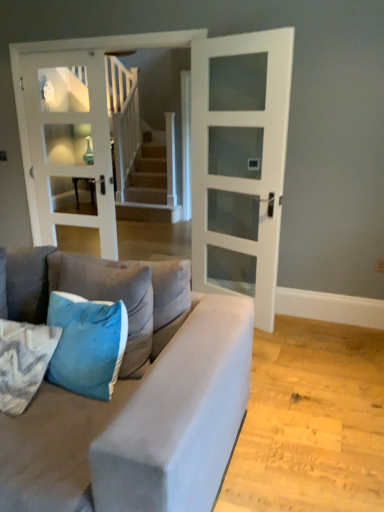
The height and width of the screenshot is (512, 384). What do you see at coordinates (111, 296) in the screenshot?
I see `velvet blue pillow at lower left, the third pillow in the left-to-right sequence` at bounding box center [111, 296].

What do you see at coordinates (70, 141) in the screenshot? I see `white glass door at center, the 2th door in the right-to-left sequence` at bounding box center [70, 141].

Locate an element on the screen. The width and height of the screenshot is (384, 512). suede gray couch at lower left is located at coordinates (129, 400).

The width and height of the screenshot is (384, 512). I want to click on velvet blue pillow at lower left, the first pillow when ordered from right to left, so click(111, 296).

From their relative heights in the image, would you say teal velvet pillow at lower left, marked as the 2th pillow in a right-to-left arrangement, is taller or shorter than white glass door at center, the 2th door when ordered from left to right?

Clearly, teal velvet pillow at lower left, marked as the 2th pillow in a right-to-left arrangement, is shorter compared to white glass door at center, the 2th door when ordered from left to right.

Are teal velvet pillow at lower left, marked as the 2th pillow in a right-to-left arrangement, and white glass door at center, the 2th door when ordered from left to right, located far from each other?

Yes, teal velvet pillow at lower left, marked as the 2th pillow in a right-to-left arrangement, and white glass door at center, the 2th door when ordered from left to right, are located far from each other.

Is white glass door at center, the 2th door when ordered from left to right, surrounded by teal velvet pillow at lower left, marked as the 2th pillow in a right-to-left arrangement?

No, white glass door at center, the 2th door when ordered from left to right, is not inside teal velvet pillow at lower left, marked as the 2th pillow in a right-to-left arrangement.

Based on their sizes in the image, would you say teal velvet pillow at lower left, marked as the 2th pillow in a right-to-left arrangement, is bigger or smaller than white glass door at center, which is counted as the 1th door, starting from the right?

Clearly, teal velvet pillow at lower left, marked as the 2th pillow in a right-to-left arrangement, is smaller in size than white glass door at center, which is counted as the 1th door, starting from the right.

Is white glass door at center, the 2th door when ordered from left to right, closer to the viewer compared to blue fabric pillow at lower left, which is the 1th pillow in left-to-right order?

No.

Looking at this image, is blue fabric pillow at lower left, which is the 3th pillow from right to left, surrounded by white glass door at center, which is counted as the 1th door, starting from the right?

No, blue fabric pillow at lower left, which is the 3th pillow from right to left, is not inside white glass door at center, which is counted as the 1th door, starting from the right.

Is white glass door at center, which is counted as the 1th door, starting from the right, turned away from blue fabric pillow at lower left, which is the 1th pillow in left-to-right order?

No, white glass door at center, which is counted as the 1th door, starting from the right,'s orientation is not away from blue fabric pillow at lower left, which is the 1th pillow in left-to-right order.

From the image's perspective, is white glass door at center, which is counted as the 1th door, starting from the right, positioned above or below blue fabric pillow at lower left, which is the 3th pillow from right to left?

From the image's perspective, white glass door at center, which is counted as the 1th door, starting from the right, appears above blue fabric pillow at lower left, which is the 3th pillow from right to left.

How many degrees apart are the facing directions of white glass door at center, which is counted as the 1th door, starting from the right, and teal velvet pillow at lower left, marked as the 2th pillow in a left-to-right arrangement?

154 degrees separate the facing orientations of white glass door at center, which is counted as the 1th door, starting from the right, and teal velvet pillow at lower left, marked as the 2th pillow in a left-to-right arrangement.

Is white glass door at center, which is counted as the 1th door, starting from the right, inside the boundaries of teal velvet pillow at lower left, marked as the 2th pillow in a right-to-left arrangement, or outside?

white glass door at center, which is counted as the 1th door, starting from the right, is not inside teal velvet pillow at lower left, marked as the 2th pillow in a right-to-left arrangement, it's outside.

Based on the photo, is white glass door at center, which is counted as the 1th door, starting from the right, touching teal velvet pillow at lower left, marked as the 2th pillow in a left-to-right arrangement?

No, white glass door at center, which is counted as the 1th door, starting from the right, is not beside teal velvet pillow at lower left, marked as the 2th pillow in a left-to-right arrangement.

Does point (279, 127) come behind point (54, 376)?

Yes.

In the image, is teal velvet pillow at lower left, marked as the 2th pillow in a left-to-right arrangement, positioned in front of or behind velvet blue pillow at lower left, the third pillow in the left-to-right sequence?

teal velvet pillow at lower left, marked as the 2th pillow in a left-to-right arrangement, is positioned closer to the viewer than velvet blue pillow at lower left, the third pillow in the left-to-right sequence.

From the image's perspective, which object appears higher, teal velvet pillow at lower left, marked as the 2th pillow in a left-to-right arrangement, or velvet blue pillow at lower left, the first pillow when ordered from right to left?

velvet blue pillow at lower left, the first pillow when ordered from right to left, from the image's perspective.

Is teal velvet pillow at lower left, marked as the 2th pillow in a right-to-left arrangement, looking in the opposite direction of velvet blue pillow at lower left, the first pillow when ordered from right to left?

Absolutely, teal velvet pillow at lower left, marked as the 2th pillow in a right-to-left arrangement, is directed away from velvet blue pillow at lower left, the first pillow when ordered from right to left.

Who is taller, teal velvet pillow at lower left, marked as the 2th pillow in a right-to-left arrangement, or velvet blue pillow at lower left, the first pillow when ordered from right to left?

Standing taller between the two is velvet blue pillow at lower left, the first pillow when ordered from right to left.

Can you tell me how much white glass door at center, which is counted as the 1th door, starting from the right, and suede gray couch at lower left differ in facing direction?

There is a 113-degree angle between the facing directions of white glass door at center, which is counted as the 1th door, starting from the right, and suede gray couch at lower left.

Does white glass door at center, the 2th door when ordered from left to right, turn towards suede gray couch at lower left?

Yes, white glass door at center, the 2th door when ordered from left to right, is turned towards suede gray couch at lower left.

Does white glass door at center, the 2th door when ordered from left to right, lie in front of suede gray couch at lower left?

No.

From a real-world perspective, which object stands above the other?

white glass door at center, which is counted as the 1th door, starting from the right, is physically above.

In terms of width, does white glass door at center, which is counted as the 1th door, starting from the right, look wider or thinner when compared to velvet blue pillow at lower left, the third pillow in the left-to-right sequence?

Clearly, white glass door at center, which is counted as the 1th door, starting from the right, has less width compared to velvet blue pillow at lower left, the third pillow in the left-to-right sequence.

Looking at the image, does white glass door at center, which is counted as the 1th door, starting from the right, seem bigger or smaller compared to velvet blue pillow at lower left, the first pillow when ordered from right to left?

white glass door at center, which is counted as the 1th door, starting from the right, is bigger than velvet blue pillow at lower left, the first pillow when ordered from right to left.

Is white glass door at center, which is counted as the 1th door, starting from the right, far away from velvet blue pillow at lower left, the third pillow in the left-to-right sequence?

Indeed, white glass door at center, which is counted as the 1th door, starting from the right, is not near velvet blue pillow at lower left, the third pillow in the left-to-right sequence.

Which of these two, velvet blue pillow at lower left, the first pillow when ordered from right to left, or suede gray couch at lower left, stands taller?

suede gray couch at lower left.

Which object is positioned more to the left, velvet blue pillow at lower left, the first pillow when ordered from right to left, or suede gray couch at lower left?

suede gray couch at lower left.

Is suede gray couch at lower left at the back of velvet blue pillow at lower left, the first pillow when ordered from right to left?

Absolutely, velvet blue pillow at lower left, the first pillow when ordered from right to left, is directed away from suede gray couch at lower left.

Locate an element on the screen. the 2nd pillow in front of the white glass door at center, which is counted as the 1th door, starting from the right is located at coordinates (87, 344).

This screenshot has height=512, width=384. I want to click on pillow that is the 3rd one when counting leftward from the white glass door at center, which is counted as the 1th door, starting from the right, so click(23, 362).

Looking at the image, which one is located closer to suede gray couch at lower left, velvet blue pillow at lower left, the first pillow when ordered from right to left, or white glass door at center, the 2th door when ordered from left to right?

velvet blue pillow at lower left, the first pillow when ordered from right to left.

Looking at the image, which one is located further to velvet blue pillow at lower left, the first pillow when ordered from right to left, white glass door at center, which is counted as the 1th door, starting from the right, or blue fabric pillow at lower left, which is the 1th pillow in left-to-right order?

The object further to velvet blue pillow at lower left, the first pillow when ordered from right to left, is white glass door at center, which is counted as the 1th door, starting from the right.

From the image, which object appears to be nearer to teal velvet pillow at lower left, marked as the 2th pillow in a left-to-right arrangement, blue fabric pillow at lower left, which is the 3th pillow from right to left, or white glass door at center, the 2th door when ordered from left to right?

blue fabric pillow at lower left, which is the 3th pillow from right to left, is positioned closer to the anchor teal velvet pillow at lower left, marked as the 2th pillow in a left-to-right arrangement.

Based on their spatial positions, is white glass door at center, the 2th door in the right-to-left sequence, or blue fabric pillow at lower left, which is the 3th pillow from right to left, further from velvet blue pillow at lower left, the third pillow in the left-to-right sequence?

Among the two, white glass door at center, the 2th door in the right-to-left sequence, is located further to velvet blue pillow at lower left, the third pillow in the left-to-right sequence.

Estimate the real-world distances between objects in this image. Which object is further from white glass door at center, the 2th door when ordered from left to right, blue fabric pillow at lower left, which is the 3th pillow from right to left, or velvet blue pillow at lower left, the third pillow in the left-to-right sequence?

blue fabric pillow at lower left, which is the 3th pillow from right to left.

Estimate the real-world distances between objects in this image. Which object is closer to white glass door at center, the 2th door in the right-to-left sequence, suede gray couch at lower left or velvet blue pillow at lower left, the third pillow in the left-to-right sequence?

velvet blue pillow at lower left, the third pillow in the left-to-right sequence.

When comparing their distances from suede gray couch at lower left, does teal velvet pillow at lower left, marked as the 2th pillow in a left-to-right arrangement, or white glass door at center, the 2th door when ordered from left to right, seem further?

The object further to suede gray couch at lower left is white glass door at center, the 2th door when ordered from left to right.

Estimate the real-world distances between objects in this image. Which object is closer to teal velvet pillow at lower left, marked as the 2th pillow in a right-to-left arrangement, white glass door at center, which is counted as the first door, starting from the left, or velvet blue pillow at lower left, the third pillow in the left-to-right sequence?

velvet blue pillow at lower left, the third pillow in the left-to-right sequence, lies closer to teal velvet pillow at lower left, marked as the 2th pillow in a right-to-left arrangement, than the other object.

Find the location of a particular element. This screenshot has width=384, height=512. pillow situated between blue fabric pillow at lower left, which is the 3th pillow from right to left, and velvet blue pillow at lower left, the first pillow when ordered from right to left, from left to right is located at coordinates (87, 344).

What are the coordinates of `pillow between suede gray couch at lower left and teal velvet pillow at lower left, marked as the 2th pillow in a right-to-left arrangement, along the z-axis` in the screenshot? It's located at (23, 362).

The image size is (384, 512). Identify the location of pillow located between teal velvet pillow at lower left, marked as the 2th pillow in a left-to-right arrangement, and white glass door at center, which is counted as the first door, starting from the left, in the depth direction. (111, 296).

Locate an element on the screen. The width and height of the screenshot is (384, 512). door positioned between blue fabric pillow at lower left, which is the 1th pillow in left-to-right order, and white glass door at center, which is counted as the first door, starting from the left, from near to far is located at coordinates (240, 163).